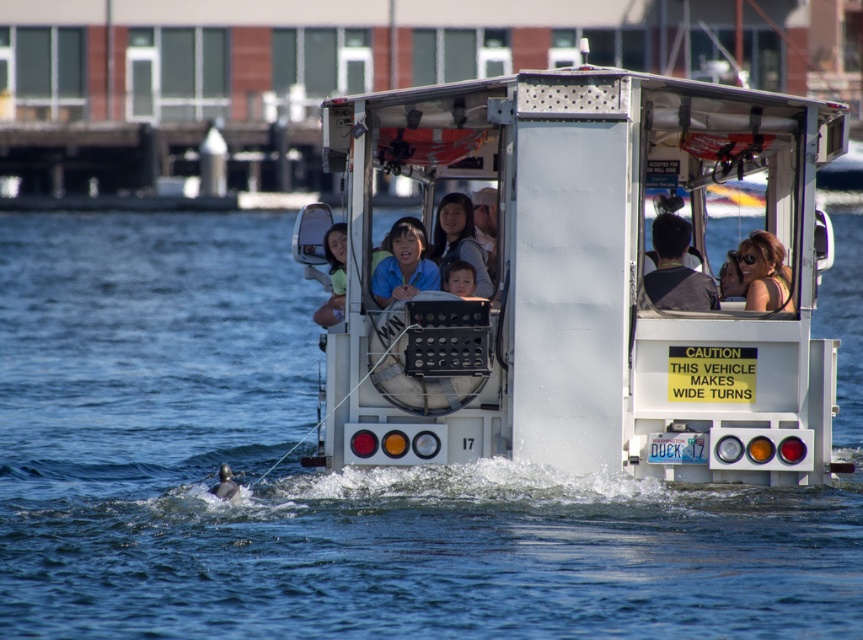
Between white metallic boat at center and matte blue shirt at center, which one has more height?

matte blue shirt at center is taller.

Can you confirm if white metallic boat at center is wider than matte blue shirt at center?

Yes, white metallic boat at center is wider than matte blue shirt at center.

The height and width of the screenshot is (640, 863). I want to click on white metallic boat at center, so click(x=584, y=284).

Which is below, clear blue water at center or matte black sunglasses at center?

clear blue water at center is below.

Which is above, clear blue water at center or matte black sunglasses at center?

matte black sunglasses at center is above.

You are a GUI agent. You are given a task and a screenshot of the screen. Output one action in this format:
    pyautogui.click(x=<x>, y=<y>)
    Task: Click on the clear blue water at center
    
    Given the screenshot: What is the action you would take?
    pyautogui.click(x=344, y=474)

Which is more to the right, matte black sunglasses at center or smooth skin face at center?

Positioned to the right is matte black sunglasses at center.

Which is more to the left, matte black sunglasses at center or smooth skin face at center?

Positioned to the left is smooth skin face at center.

Which is behind, point (764, 268) or point (469, 278)?

The point (764, 268) is behind.

Locate an element on the screen. The height and width of the screenshot is (640, 863). matte black sunglasses at center is located at coordinates (764, 272).